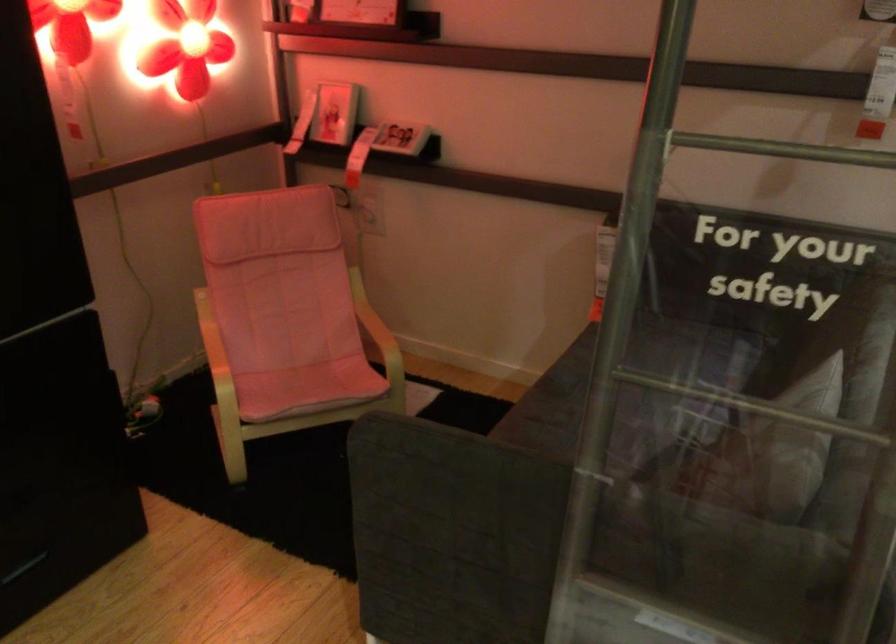
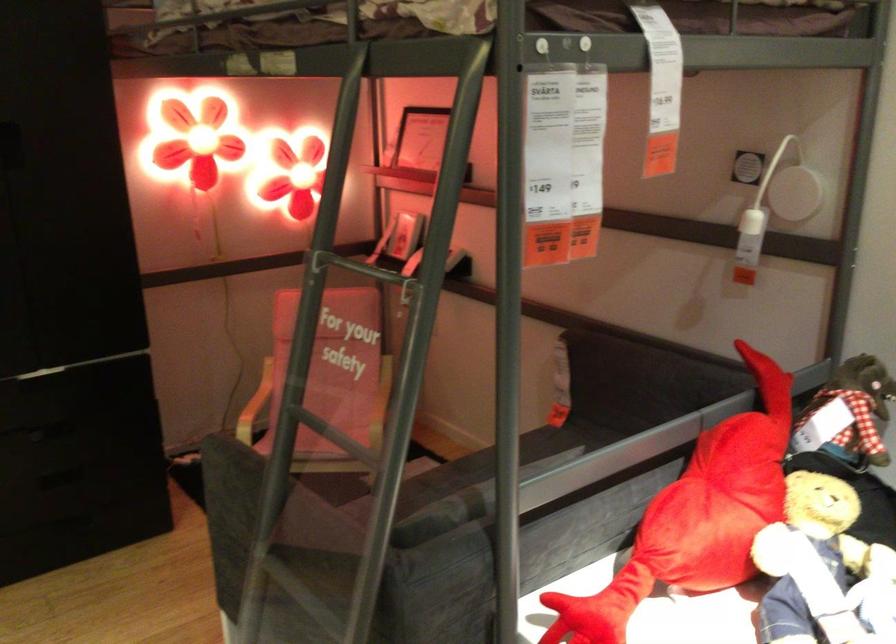
Locate, in the second image, the point that corresponds to point (307, 333) in the first image.

(331, 404)